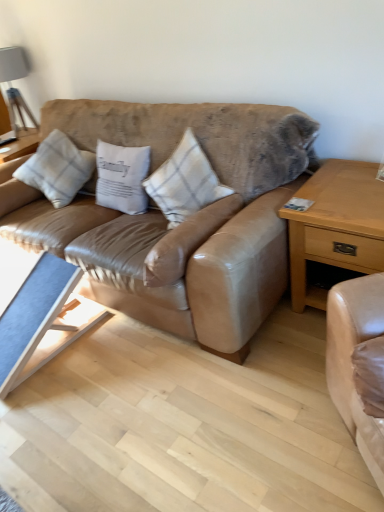
Question: From a real-world perspective, is matte gray lampshade at upper left above or below leather couch at center?

Choices:
 (A) above
 (B) below

Answer: (A)

Question: Is point (24, 54) closer or farther from the camera than point (183, 312)?

Choices:
 (A) farther
 (B) closer

Answer: (A)

Question: Which of these objects is positioned farthest from the blue fabric coffee table at lower left?

Choices:
 (A) matte gray lampshade at upper left
 (B) white cotton pillow at center, which ranks as the 3th pillow in left-to-right order
 (C) leather couch at center
 (D) white cotton pillow at center, the 2th pillow from the left
 (E) white plaid pillow at center, the first pillow in the left-to-right sequence

Answer: (A)

Question: Based on their relative distances, which object is farther from the leather couch at center?

Choices:
 (A) blue fabric coffee table at lower left
 (B) matte gray lampshade at upper left
 (C) white plaid pillow at center, the first pillow in the left-to-right sequence
 (D) light brown wood nightstand at right
 (E) white cotton pillow at center, the 2th pillow from the left

Answer: (B)